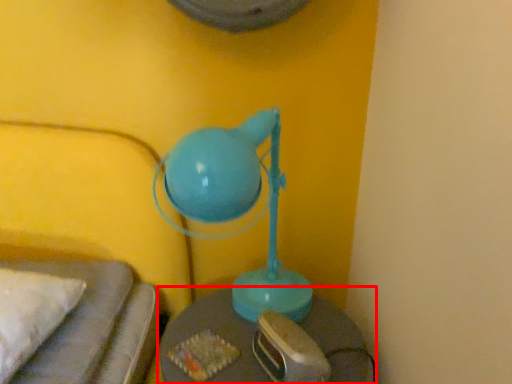
Question: From the image's perspective, where is table (annotated by the red box) located relative to lamp?

Choices:
 (A) above
 (B) below

Answer: (B)